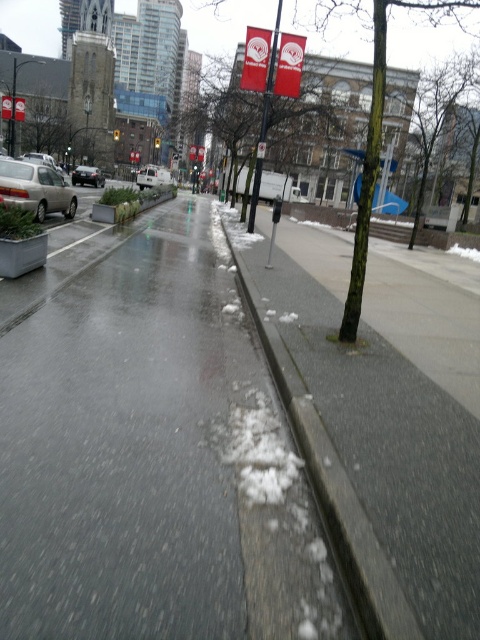
Can you confirm if gray concrete curb at lower center is thinner than silver metallic sedan at left?

Yes.

Which is in front, point (291, 396) or point (34, 195)?

Point (291, 396) is in front.

Describe the element at coordinates (332, 490) in the screenshot. Image resolution: width=480 pixels, height=640 pixels. I see `gray concrete curb at lower center` at that location.

This screenshot has width=480, height=640. I want to click on gray concrete curb at lower center, so point(332,490).

Is silver metallic sedan at left to the right of white matte van at center from the viewer's perspective?

Yes, silver metallic sedan at left is to the right of white matte van at center.

Does silver metallic sedan at left have a larger size compared to white matte van at center?

No.

Is point (24, 188) in front of point (156, 166)?

Yes.

Identify the location of silver metallic sedan at left. (36, 188).

Between silver metallic sedan at left and shiny silver sedan at center, which one is positioned lower?

silver metallic sedan at left is lower down.

Find the location of a particular element. silver metallic sedan at left is located at coordinates (36, 188).